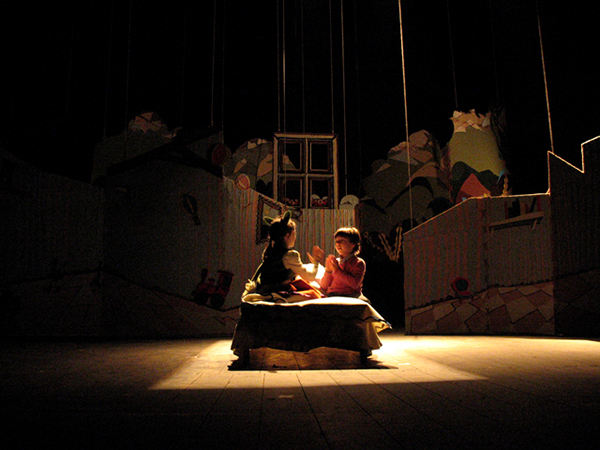
Locate an element on the screen. The image size is (600, 450). window is located at coordinates (300, 155).